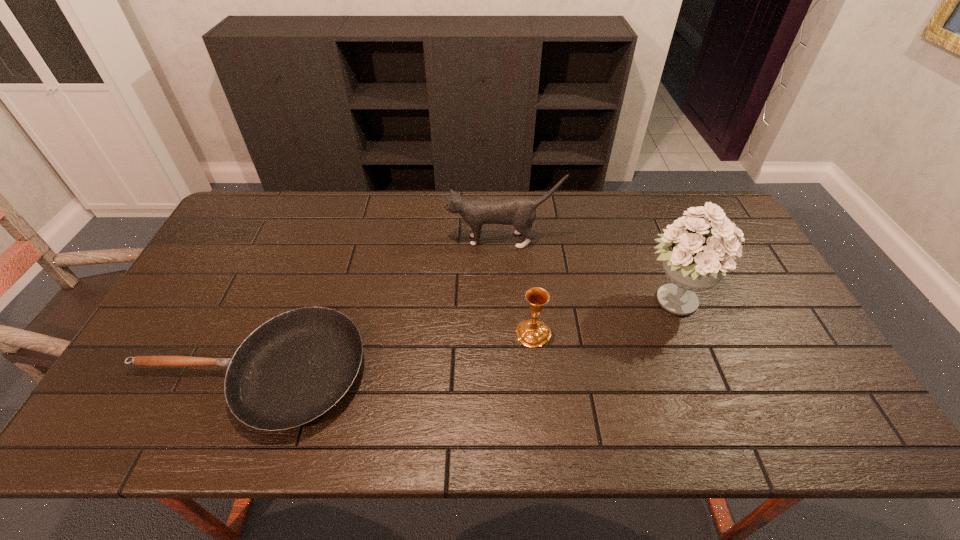
Where is `vacant area that lies between the tallest object and the chalice`? vacant area that lies between the tallest object and the chalice is located at coordinates (603, 317).

Find the location of a particular element. The height and width of the screenshot is (540, 960). vacant space in between the second shortest object and the tallest object is located at coordinates (603, 317).

The image size is (960, 540). In order to click on free space between the shortest object and the farthest object in this screenshot , I will do `click(375, 307)`.

Locate an element on the screen. The width and height of the screenshot is (960, 540). the second closest object relative to the third tallest object is located at coordinates (521, 212).

Point out which object is positioned as the nearest to the tallest object. Please provide its 2D coordinates. Your answer should be formatted as a tuple, i.e. [(x, y)], where the tuple contains the x and y coordinates of a point satisfying the conditions above.

[(521, 212)]

This screenshot has width=960, height=540. I want to click on free spot that satisfies the following two spatial constraints: 1. at the face of the second tallest object; 2. on the back side of the second shortest object, so click(507, 333).

Identify the location of vacant space that satisfies the following two spatial constraints: 1. at the face of the third shortest object; 2. on the left side of the tallest object. This screenshot has height=540, width=960. (506, 301).

This screenshot has width=960, height=540. I want to click on vacant area that satisfies the following two spatial constraints: 1. at the face of the bouquet; 2. on the right side of the third shortest object, so click(506, 301).

You are a GUI agent. You are given a task and a screenshot of the screen. Output one action in this format:
    pyautogui.click(x=<x>, y=<y>)
    Task: Click on the free space that satisfies the following two spatial constraints: 1. at the face of the third tallest object; 2. on the right side of the farthest object
    Image resolution: width=960 pixels, height=540 pixels.
    Given the screenshot: What is the action you would take?
    pyautogui.click(x=507, y=333)

Where is `free location that satisfies the following two spatial constraints: 1. at the face of the second tallest object; 2. on the left side of the bouquet`? free location that satisfies the following two spatial constraints: 1. at the face of the second tallest object; 2. on the left side of the bouquet is located at coordinates (506, 301).